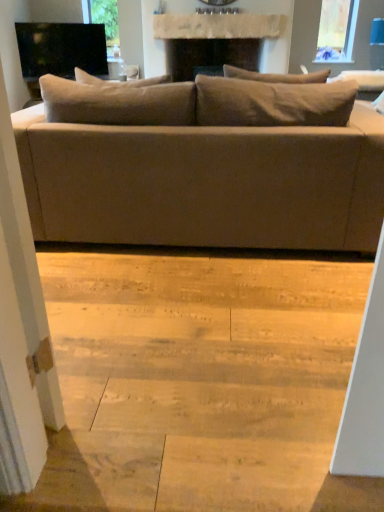
At what (x,y) coordinates should I click in order to perform the action: click on unoccupied space behind transparent glass screen door at left. Please return your answer as a coordinate pair (x, y). The image size is (384, 512). Looking at the image, I should click on (81, 381).